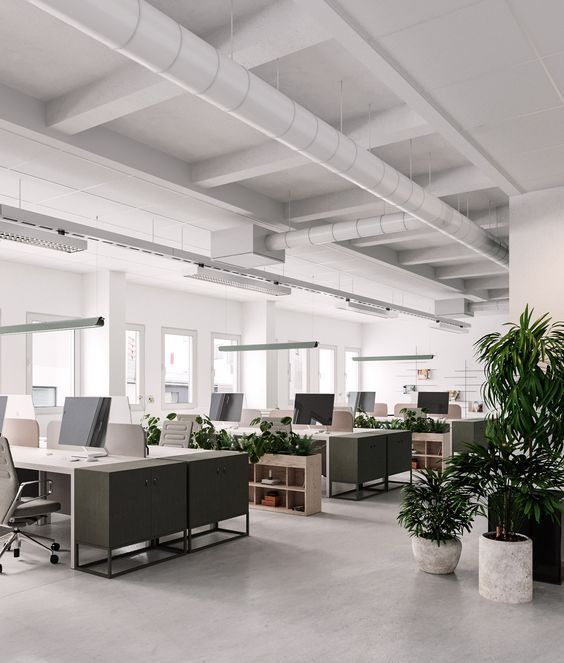
Locate an element on the screen. This screenshot has height=663, width=564. ceiling beams is located at coordinates (345, 202), (261, 158), (144, 90), (417, 231), (440, 261), (468, 271), (487, 288).